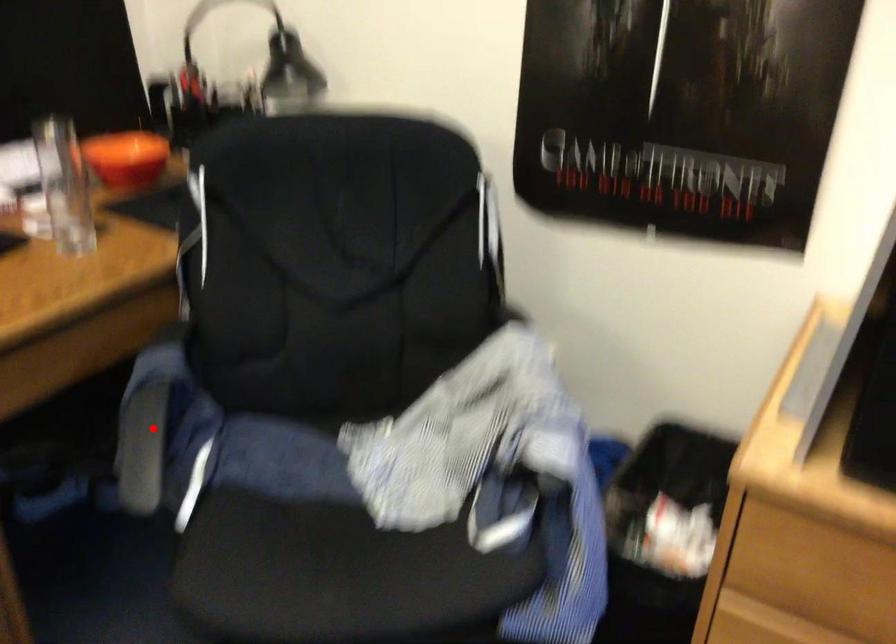
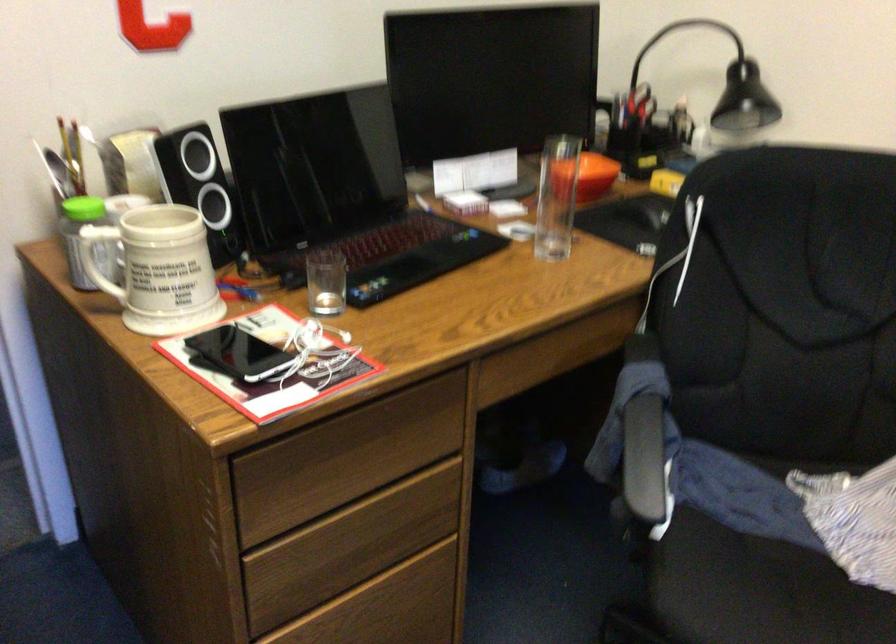
Where in the second image is the point corresponding to the highlighted location from the first image?

(642, 442)